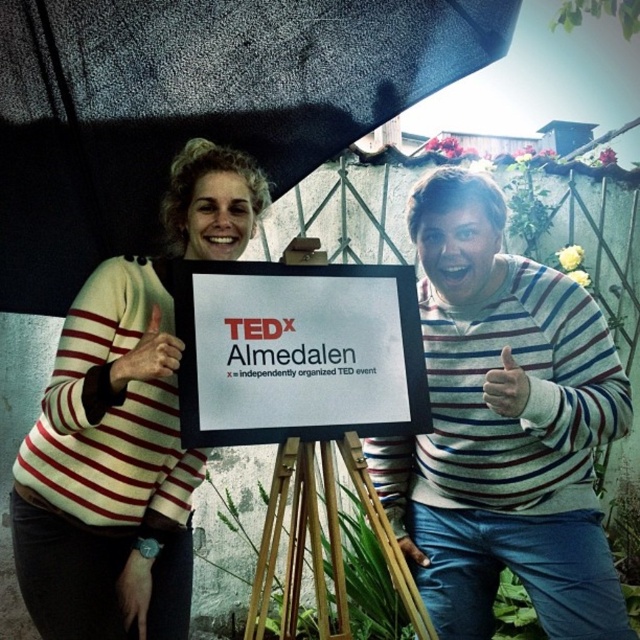
Who is positioned more to the left, black matte umbrella at upper center or striped sweater at left?

Positioned to the left is striped sweater at left.

Does point (35, 182) come in front of point (132, 333)?

That is False.

What do you see at coordinates (195, 106) in the screenshot? I see `black matte umbrella at upper center` at bounding box center [195, 106].

This screenshot has height=640, width=640. Find the location of `black matte umbrella at upper center`. black matte umbrella at upper center is located at coordinates (195, 106).

Between black matte umbrella at upper center and white paper sign at center, which one appears on the left side from the viewer's perspective?

Positioned to the left is black matte umbrella at upper center.

Does black matte umbrella at upper center appear on the left side of white paper sign at center?

Indeed, black matte umbrella at upper center is positioned on the left side of white paper sign at center.

Which is behind, point (195, 38) or point (220, 264)?

The point (195, 38) is behind.

What are the coordinates of `black matte umbrella at upper center` in the screenshot? It's located at (195, 106).

Who is lower down, striped sweater at left or wooden tripod at center?

wooden tripod at center is lower down.

Based on the photo, between striped sweater at left and wooden tripod at center, which one is positioned higher?

striped sweater at left is above.

Which is in front, point (61, 401) or point (344, 442)?

Point (61, 401)

Identify the location of striped sweater at left. pyautogui.click(x=124, y=428).